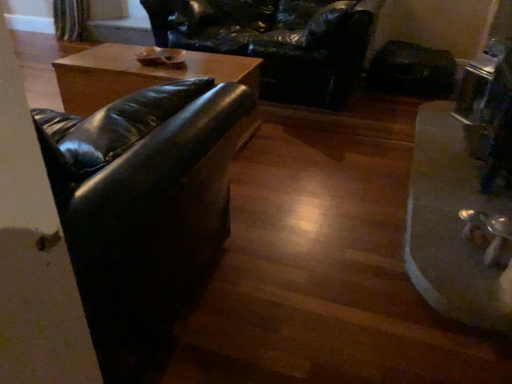
You are a GUI agent. You are given a task and a screenshot of the screen. Output one action in this format:
    pyautogui.click(x=<x>, y=<y>)
    Task: Click on the free location to the right of black leather couch at left
    The height and width of the screenshot is (384, 512).
    Given the screenshot: What is the action you would take?
    pyautogui.click(x=325, y=252)